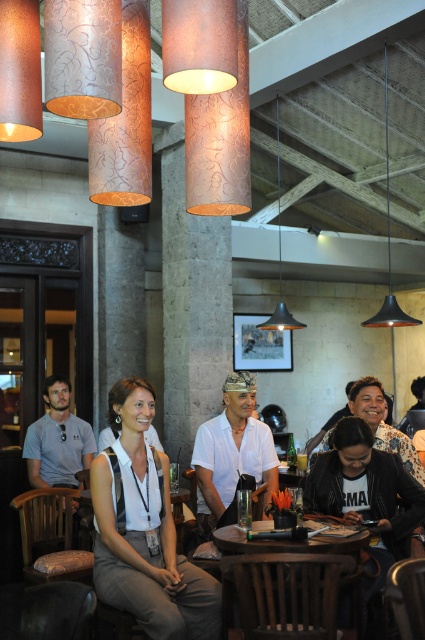
What do you see at coordinates (144, 529) in the screenshot? The width and height of the screenshot is (425, 640). I see `white fabric shirt at center` at bounding box center [144, 529].

Can you confirm if white fabric shirt at center is thinner than metallic pendant light at center?

No.

Find the location of a particular element. white fabric shirt at center is located at coordinates (144, 529).

Is black leather jacket at lower right below black matte pendant light at upper right?

Yes.

Does black leather jacket at lower right have a smaller size compared to black matte pendant light at upper right?

No, black leather jacket at lower right is not smaller than black matte pendant light at upper right.

In order to click on black leather jacket at lower right in this screenshot , I will do `click(365, 492)`.

Which is more to the right, white matte shirt at center or wooden table at center?

wooden table at center is more to the right.

Does point (218, 436) come in front of point (277, 545)?

No, (218, 436) is further to viewer.

Is point (206, 504) more distant than point (255, 547)?

Yes, point (206, 504) is behind point (255, 547).

I want to click on white matte shirt at center, so pyautogui.click(x=232, y=451).